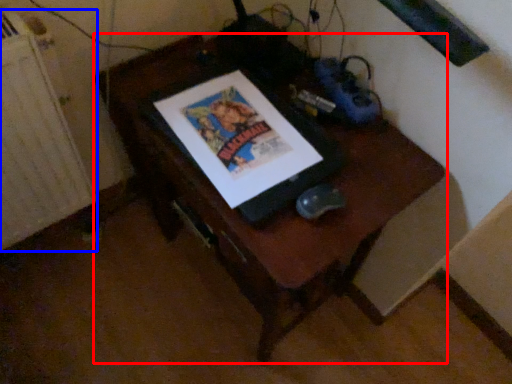
Question: Which object is further to the camera taking this photo, furniture (highlighted by a red box) or radiator (highlighted by a blue box)?

Choices:
 (A) furniture
 (B) radiator

Answer: (B)